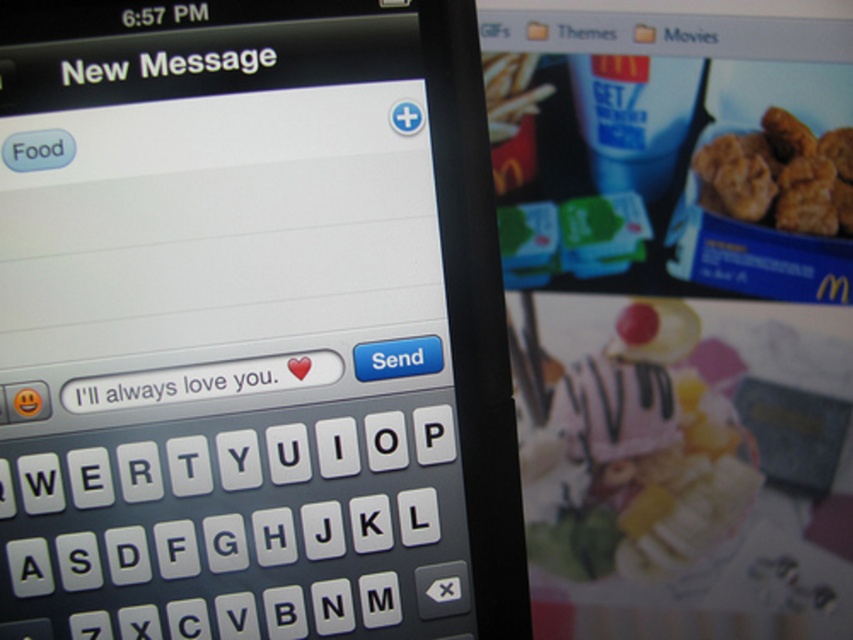
You are holding a black plastic smartphone at center and want to send a white matte text message at center. Considering their sizes, will the message fit entirely on the screen without needing to scroll?

The black plastic smartphone at center has a larger size compared to white matte text message at center, so the message will fit entirely on the screen without needing to scroll.

You are composing a message on your phone. You want to make sure that the golden crispy nuggets at upper right and the white matte text message at center are both visible. Which one should you prioritize keeping in view if you have limited screen space?

The golden crispy nuggets at upper right is larger in size than the white matte text message at center, so you should prioritize keeping the golden crispy nuggets at upper right in view to ensure both fit on the screen.

Looking at this image, you are holding a smartphone and want to edit the text in the white matte text message at center. To do this, you need to interact with the white plastic keyboard at center. Is the keyboard closer to your hand than the text message?

The white plastic keyboard at center is further to the viewer than the white matte text message at center, so the keyboard is closer to your hand than the text message. Yes, you can interact with the keyboard to edit the text.